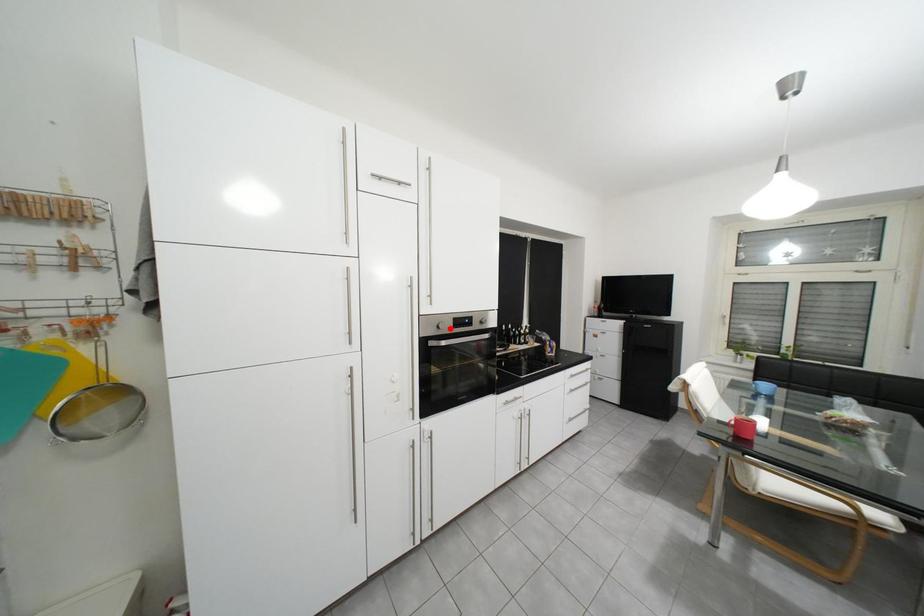
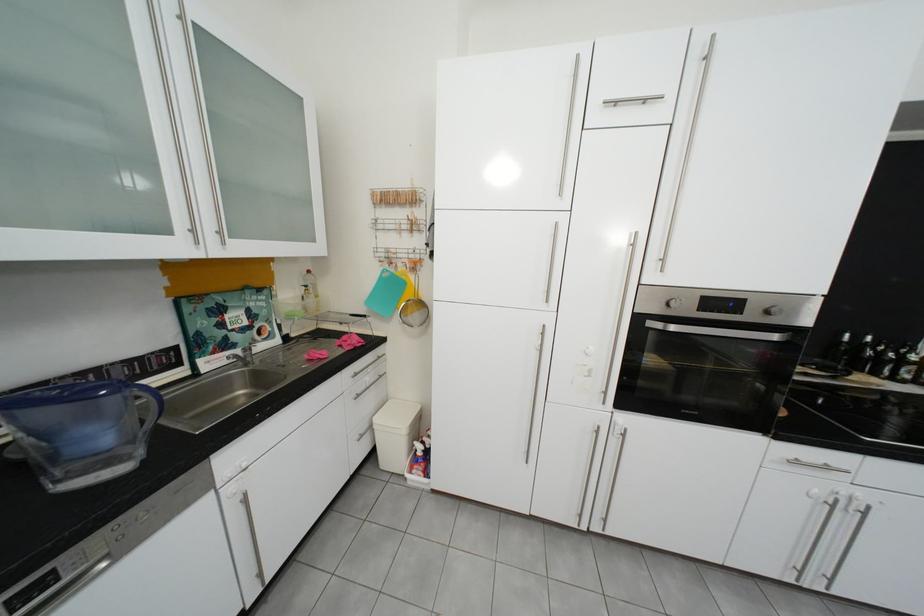
The point at the highlighted location is marked in the first image. Where is the corresponding point in the second image?

(679, 306)